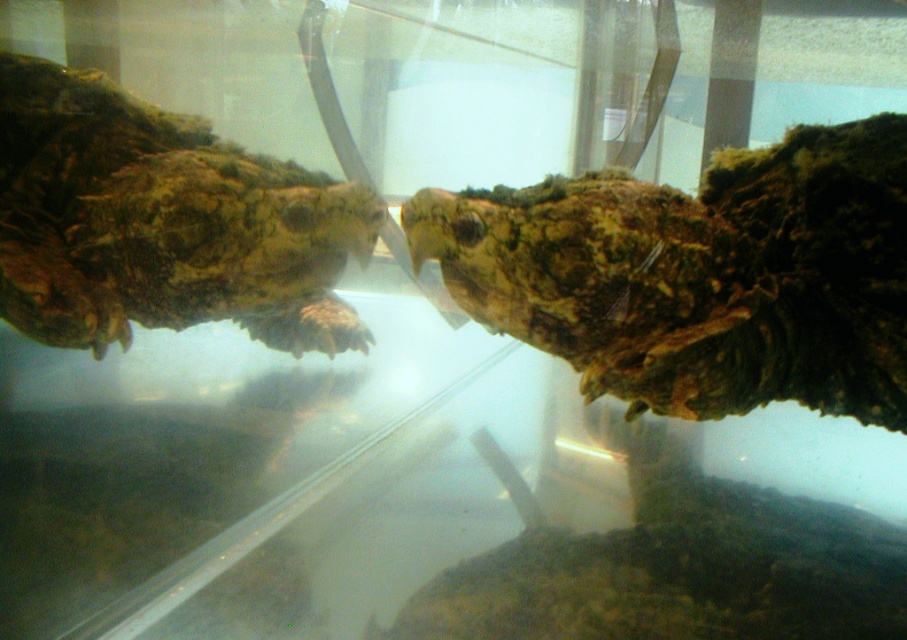
From the picture: You are a zookeeper observing two turtles in an aquarium. You notice the textured brown reptile at center and the green mossy turtle head at left. Which turtle has a shorter height between them?

The textured brown reptile at center is shorter than the green mossy turtle head at left.

You are a researcher observing two turtles in an aquarium. You notice a point at coordinates (x=700, y=275). What object is located at that point?

The point at coordinates (x=700, y=275) indicates a textured brown reptile at center.

You are a researcher observing an aquarium setup. You need to place a small sensor on the textured brown reptile at center. What are the coordinates where you should place it?

The coordinates for the textured brown reptile at center are at point (700,275).